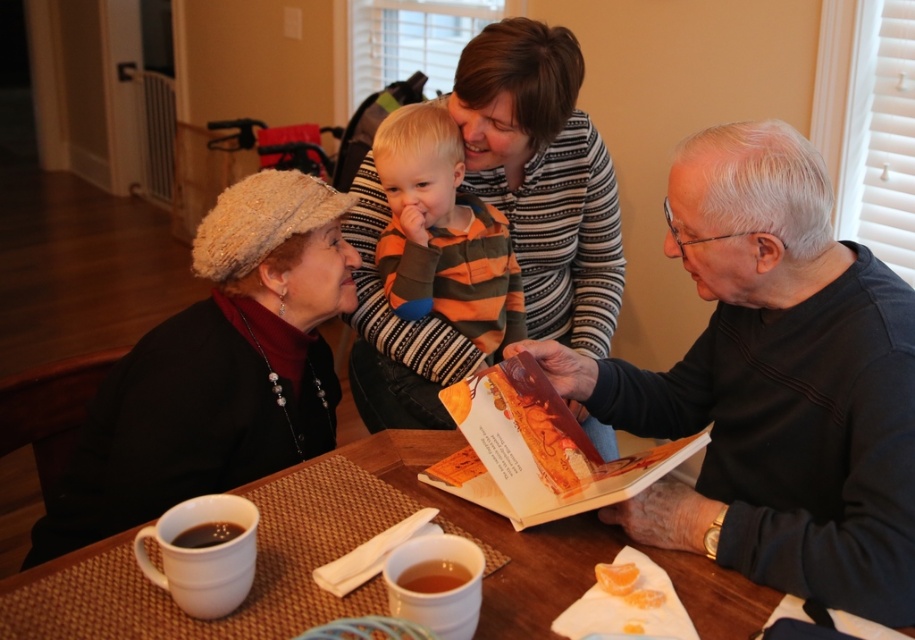
You are designing a new layout for a living room and want to place a striped sweater at upper center and a brown woven table at center. Considering their sizes, which object should be placed closer to the wall to avoid blocking the view?

The striped sweater at upper center should be placed closer to the wall since it has a lesser width compared to the brown woven table at center, allowing the table to be positioned more centrally without obstructing the view.

You are standing at the center of the dining table and want to pick up the matte black jacket at lower left. Which direction should you move to reach it?

The matte black jacket at lower left is located at point 0.577 on the x axis and 0.239 on the y axis. Since you are at the center, you should move to the left and slightly forward to reach it.